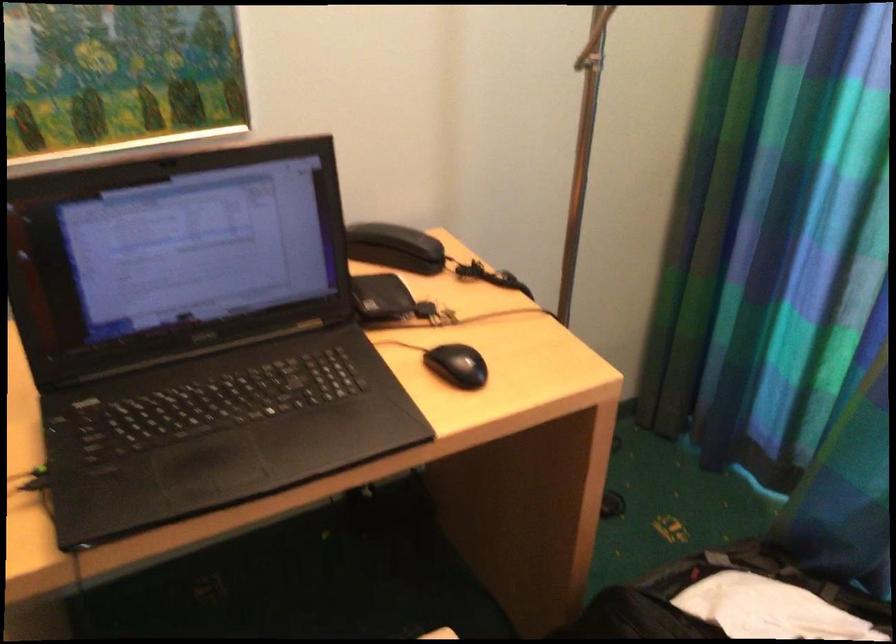
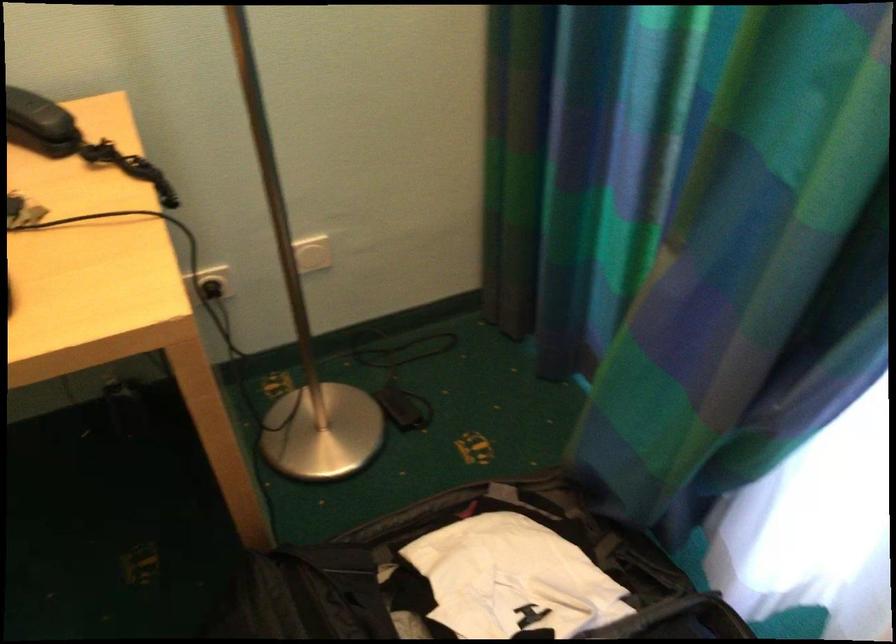
Question: The first image is from the beginning of the video and the second image is from the end. How did the camera likely rotate when shooting the video?

Choices:
 (A) Left
 (B) Right
 (C) Up
 (D) Down

Answer: (D)